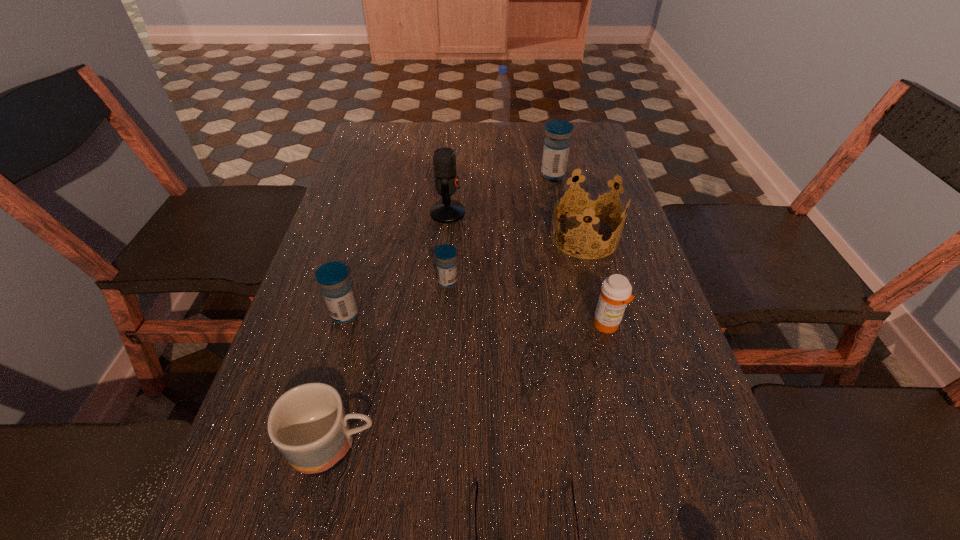
Find the location of a particular element. Image resolution: width=960 pixels, height=540 pixels. free location located on the back of the second blue medicine from left to right is located at coordinates (450, 254).

The image size is (960, 540). I want to click on object that is at the far edge, so click(502, 87).

Find the location of a particular element. medicine situated at the left edge is located at coordinates (333, 277).

Where is `mug that is at the left edge`? mug that is at the left edge is located at coordinates (308, 424).

Locate an element on the screen. Image resolution: width=960 pixels, height=540 pixels. crown present at the right edge is located at coordinates (591, 204).

Identify the location of free space at the left edge. The image size is (960, 540). (389, 244).

This screenshot has height=540, width=960. I want to click on empty location between the orange medicine and the second farthest medicine, so click(527, 303).

Where is `free spot between the microphone and the orange medicine`? The height and width of the screenshot is (540, 960). free spot between the microphone and the orange medicine is located at coordinates (527, 268).

Identify the location of free space between the bottle and the blue mug. (418, 286).

Where is `object that ranks as the third closest to the orange medicine`? The height and width of the screenshot is (540, 960). object that ranks as the third closest to the orange medicine is located at coordinates (477, 481).